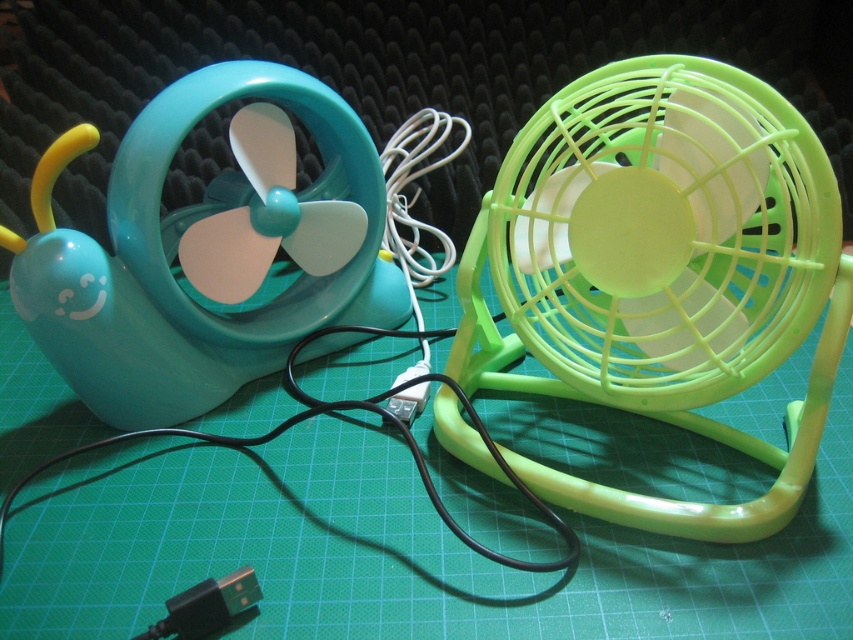
Does lime green plastic fan at right come behind black plastic usb plug at center?

No.

Is lime green plastic fan at right below black plastic usb plug at center?

Actually, lime green plastic fan at right is above black plastic usb plug at center.

Does point (780, 216) lie in front of point (421, 362)?

Yes.

Locate an element on the screen. Image resolution: width=853 pixels, height=640 pixels. lime green plastic fan at right is located at coordinates (660, 273).

Can you confirm if lime green plastic fan at right is bigger than matte plastic snail-shaped fan at left?

Yes, lime green plastic fan at right is bigger than matte plastic snail-shaped fan at left.

Consider the image. Between lime green plastic fan at right and matte plastic snail-shaped fan at left, which one has more height?

With more height is lime green plastic fan at right.

Where is `lime green plastic fan at right`? This screenshot has height=640, width=853. lime green plastic fan at right is located at coordinates (660, 273).

Identify the location of lime green plastic fan at right. (660, 273).

The width and height of the screenshot is (853, 640). What do you see at coordinates (660, 273) in the screenshot?
I see `lime green plastic fan at right` at bounding box center [660, 273].

Is lime green plastic fan at right further to the viewer compared to black plastic usb plug at lower left?

No, it is not.

The image size is (853, 640). I want to click on lime green plastic fan at right, so click(660, 273).